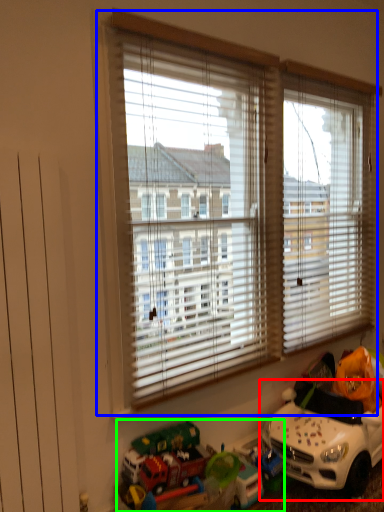
Question: Based on their relative distances, which object is farther from toy (highlighted by a red box)? Choose from window (highlighted by a blue box) and toy (highlighted by a green box).

Choices:
 (A) window
 (B) toy

Answer: (A)